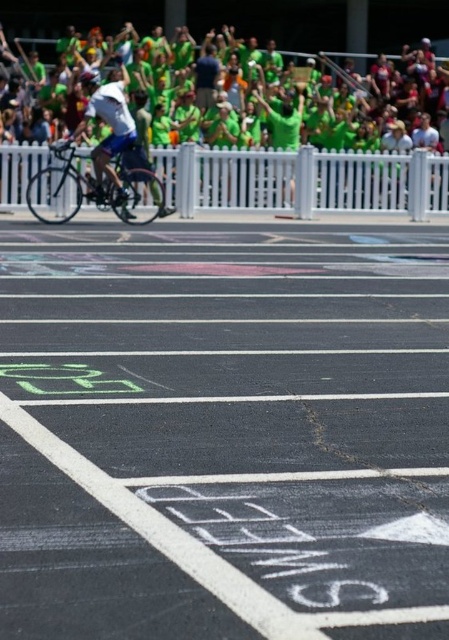
Is black asphalt race track at center thinner than shiny metallic bicycle at center?

In fact, black asphalt race track at center might be wider than shiny metallic bicycle at center.

How far apart are black asphalt race track at center and shiny metallic bicycle at center?

black asphalt race track at center is 6.02 meters away from shiny metallic bicycle at center.

Who is more distant from viewer, (347,326) or (69,182)?

The point (69,182) is more distant.

Identify the location of black asphalt race track at center. (224, 429).

What do you see at coordinates (224, 429) in the screenshot? I see `black asphalt race track at center` at bounding box center [224, 429].

Is black asphalt race track at center taller than green jersey at upper center?

Yes, black asphalt race track at center is taller than green jersey at upper center.

Locate an element on the screen. The width and height of the screenshot is (449, 640). black asphalt race track at center is located at coordinates pos(224,429).

Where is `black asphalt race track at center`? black asphalt race track at center is located at coordinates (224, 429).

Does black asphalt race track at center appear over green fabric shirt at center?

No.

You are a GUI agent. You are given a task and a screenshot of the screen. Output one action in this format:
    pyautogui.click(x=<x>, y=<y>)
    Task: Click on the black asphalt race track at center
    This screenshot has height=640, width=449.
    Given the screenshot: What is the action you would take?
    pyautogui.click(x=224, y=429)

You are a GUI agent. You are given a task and a screenshot of the screen. Output one action in this format:
    pyautogui.click(x=<x>, y=<y>)
    Task: Click on the black asphalt race track at center
    
    Given the screenshot: What is the action you would take?
    pyautogui.click(x=224, y=429)

This screenshot has width=449, height=640. I want to click on black asphalt race track at center, so click(224, 429).